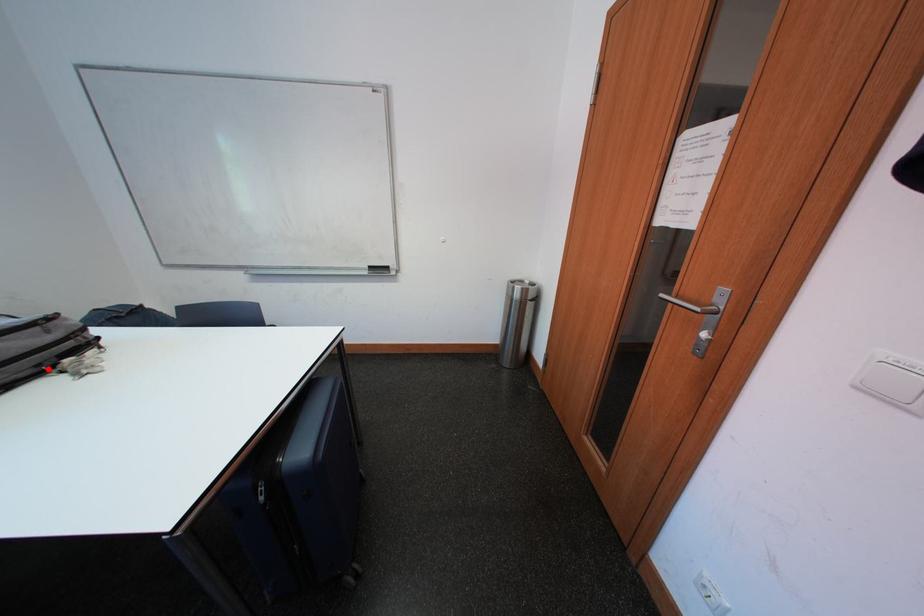
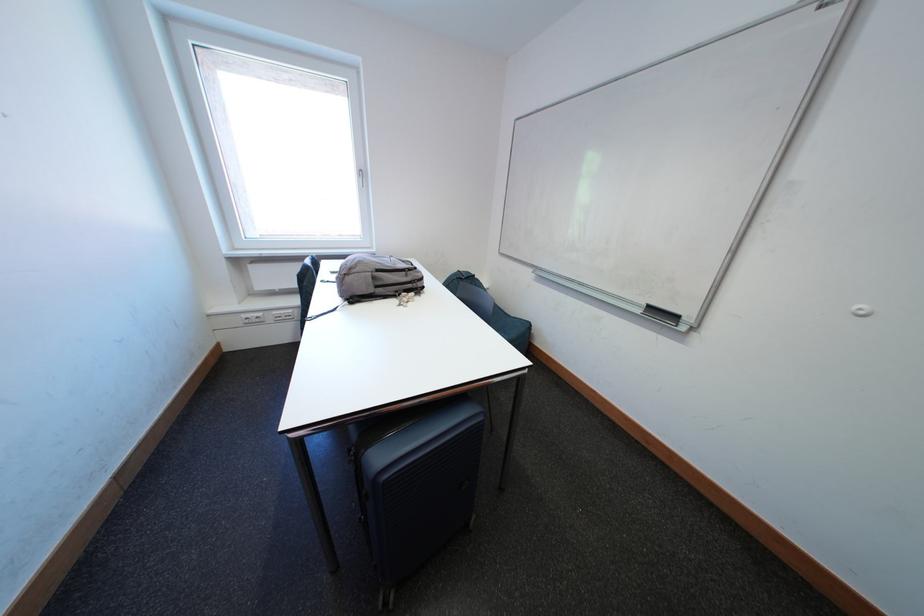
Find the pixel in the second image that matches the highlighted location in the first image.

(406, 294)